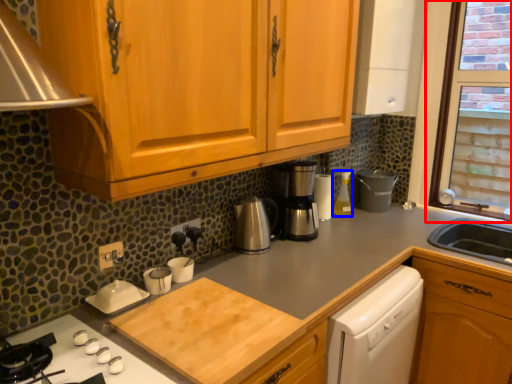
Question: Which object is further to the camera taking this photo, window (highlighted by a red box) or bottle (highlighted by a blue box)?

Choices:
 (A) window
 (B) bottle

Answer: (B)